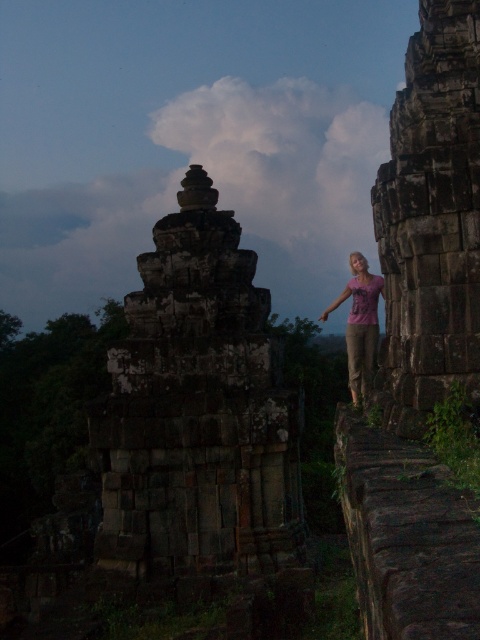
You are a tour guide leading a group at the ancient site. You want to ensure visitors stay at least 50 feet away from the dark stone ruins at center for preservation. Is the current distance of the group from the ruins sufficient?

The dark stone ruins at center are currently 76.10 feet away from the viewer, which exceeds the required 50 feet distance. Therefore, the current distance is sufficient to meet the preservation guidelines.